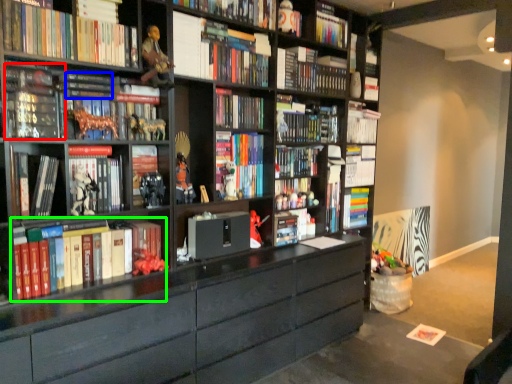
Question: Considering the real-world distances, which object is closest to book (highlighted by a red box)? book (highlighted by a blue box) or book (highlighted by a green box).

Choices:
 (A) book
 (B) book

Answer: (A)